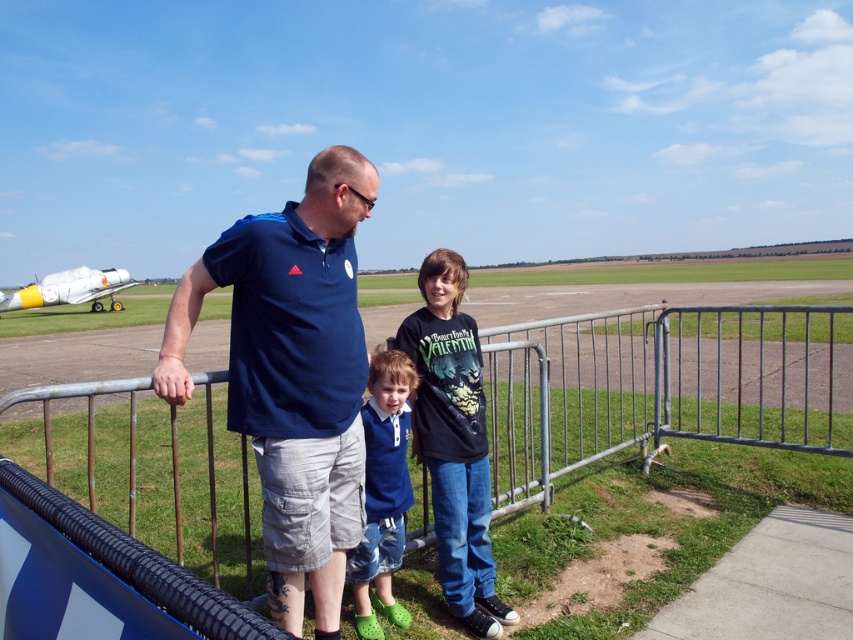
Based on the scene description, where is the metallic silver fence at center located in terms of coordinates?

The metallic silver fence at center is located at point [663,385].

You are standing at the metal barricade and want to take a photo of the matte blue shirt at center and the white glossy airplane at left. If your camera has a focal length of 50mm, which object should you focus on first to ensure both are in focus? Explain your reasoning.

The matte blue shirt at center is 26.54 meters away from the white glossy airplane at left. To ensure both are in focus, you should focus on the matte blue shirt at center because it is closer to the camera. The depth of field will extend from half the distance to the subject to infinity when focused on the closer object, maximizing the chances of both being in focus.